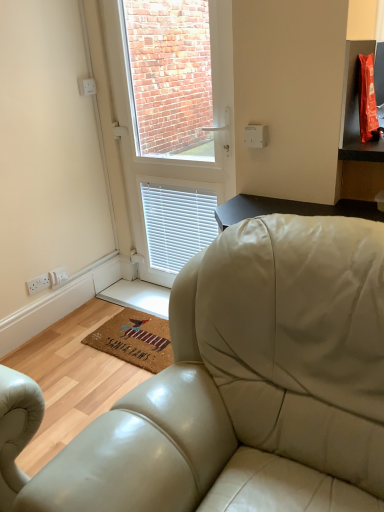
Question: Can you see white plastic socket at lower left touching white plastic window at center?

Choices:
 (A) yes
 (B) no

Answer: (B)

Question: Is white plastic socket at lower left smaller than white plastic window at center?

Choices:
 (A) yes
 (B) no

Answer: (A)

Question: Does white plastic socket at lower left lie in front of white plastic window at center?

Choices:
 (A) no
 (B) yes

Answer: (A)

Question: Are white plastic socket at lower left and white plastic window at center located far from each other?

Choices:
 (A) yes
 (B) no

Answer: (A)

Question: From the image's perspective, is white plastic socket at lower left under white plastic window at center?

Choices:
 (A) yes
 (B) no

Answer: (A)

Question: Is white plastic socket at lower left facing towards white plastic window at center?

Choices:
 (A) yes
 (B) no

Answer: (B)

Question: Is white plastic socket at lower left positioned in front of brown coir mat at lower center?

Choices:
 (A) yes
 (B) no

Answer: (B)

Question: Could you tell me if white plastic socket at lower left is facing brown coir mat at lower center?

Choices:
 (A) no
 (B) yes

Answer: (A)

Question: Does white plastic socket at lower left lie behind brown coir mat at lower center?

Choices:
 (A) yes
 (B) no

Answer: (A)

Question: Can we say white plastic socket at lower left lies outside brown coir mat at lower center?

Choices:
 (A) yes
 (B) no

Answer: (A)

Question: Is white plastic socket at lower left facing away from brown coir mat at lower center?

Choices:
 (A) yes
 (B) no

Answer: (B)

Question: From a real-world perspective, is white plastic socket at lower left under brown coir mat at lower center?

Choices:
 (A) no
 (B) yes

Answer: (A)

Question: From a real-world perspective, does white plastic window at center stand above brown coir mat at lower center?

Choices:
 (A) yes
 (B) no

Answer: (A)